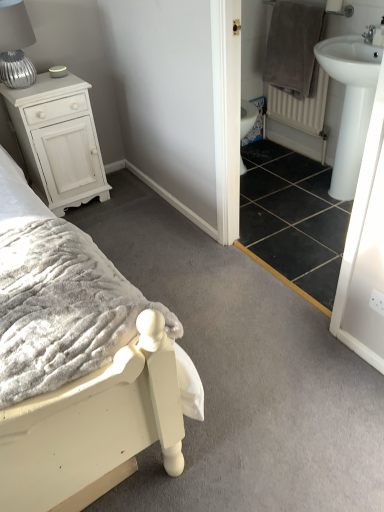
Describe the element at coordinates (293, 48) in the screenshot. I see `gray plush towel at upper right` at that location.

The height and width of the screenshot is (512, 384). What do you see at coordinates (79, 362) in the screenshot?
I see `white textured bed at center` at bounding box center [79, 362].

Describe the element at coordinates (58, 140) in the screenshot. This screenshot has width=384, height=512. I see `white painted wood chest of drawers at upper left` at that location.

Identify the location of white glossy bidet at center. (247, 117).

What do you see at coordinates (300, 106) in the screenshot? I see `white textured radiator at right` at bounding box center [300, 106].

You are a GUI agent. You are given a task and a screenshot of the screen. Output one action in this format:
    pyautogui.click(x=<x>, y=<y>)
    Task: Click on the white textured radiator at right
    Image resolution: width=384 pixels, height=512 pixels.
    Given the screenshot: What is the action you would take?
    pyautogui.click(x=300, y=106)

The height and width of the screenshot is (512, 384). Describe the element at coordinates (350, 104) in the screenshot. I see `white glossy sink at right` at that location.

What do you see at coordinates (365, 251) in the screenshot? The height and width of the screenshot is (512, 384). I see `white glossy sink at right` at bounding box center [365, 251].

I want to click on gray plush towel at upper right, so click(293, 48).

Considering the relative sizes of white glossy sink at right and gray plush towel at upper right in the image provided, is white glossy sink at right bigger than gray plush towel at upper right?

Correct, white glossy sink at right is larger in size than gray plush towel at upper right.

Is white glossy sink at right situated inside gray plush towel at upper right or outside?

white glossy sink at right exists outside the volume of gray plush towel at upper right.

Which object is positioned more to the left, white glossy sink at right or gray plush towel at upper right?

Positioned to the left is gray plush towel at upper right.

Who is taller, white glossy sink at right or gray plush towel at upper right?

With more height is white glossy sink at right.

Who is taller, white glossy bidet at center or white textured radiator at right?

Standing taller between the two is white textured radiator at right.

Which is closer, (242, 129) or (320, 126)?

Clearly, point (242, 129) is more distant from the camera than point (320, 126).

Is white textured radiator at right a part of white glossy bidet at center?

No.

Is white glossy bidet at center aimed at white textured radiator at right?

Yes, white glossy bidet at center is turned towards white textured radiator at right.

Is white textured radiator at right placed right next to white glossy sink at right?

No, white textured radiator at right is not with white glossy sink at right.

Does white textured radiator at right have a larger size compared to white glossy sink at right?

Incorrect, white textured radiator at right is not larger than white glossy sink at right.

From the image's perspective, does white textured radiator at right appear lower than white glossy sink at right?

Actually, white textured radiator at right appears above white glossy sink at right in the image.

Considering the points (320, 82) and (323, 42), which point is in front, point (320, 82) or point (323, 42)?

The point (323, 42) is closer to the camera.

Does gray plush towel at upper right turn towards white glossy bidet at center?

No.

From the image's perspective, would you say gray plush towel at upper right is shown under white glossy bidet at center?

No, from the image's perspective, gray plush towel at upper right is not beneath white glossy bidet at center.

Is gray plush towel at upper right positioned behind white glossy bidet at center?

No, gray plush towel at upper right is closer to the viewer.

Between gray plush towel at upper right and white glossy bidet at center, which one has smaller width?

With smaller width is white glossy bidet at center.

Is white glossy bidet at center not close to gray plush towel at upper right?

No, there isn't a large distance between white glossy bidet at center and gray plush towel at upper right.

Where is `bidet located on the left of gray plush towel at upper right`? Image resolution: width=384 pixels, height=512 pixels. bidet located on the left of gray plush towel at upper right is located at coordinates (247, 117).

Considering the positions of objects white glossy bidet at center and gray plush towel at upper right in the image provided, who is behind, white glossy bidet at center or gray plush towel at upper right?

white glossy bidet at center is behind.

Is white glossy bidet at center positioned with its back to gray plush towel at upper right?

That's not correct — white glossy bidet at center is not looking away from gray plush towel at upper right.

This screenshot has width=384, height=512. In order to click on sink on the right of the white textured bed at center in this screenshot , I will do `click(350, 104)`.

From a real-world perspective, relative to white textured bed at center, is white glossy sink at right vertically above or below?

Clearly, from a real-world perspective, white glossy sink at right is below white textured bed at center.

From the image's perspective, is white glossy sink at right below white textured bed at center?

No, from the image's perspective, white glossy sink at right is not beneath white textured bed at center.

In terms of height, does white glossy sink at right look taller or shorter compared to white textured bed at center?

Considering their sizes, white glossy sink at right has less height than white textured bed at center.

Does white glossy bidet at center turn towards white textured bed at center?

No, white glossy bidet at center is not facing towards white textured bed at center.

In terms of height, does white glossy bidet at center look taller or shorter compared to white textured bed at center?

Clearly, white glossy bidet at center is shorter compared to white textured bed at center.

From the image's perspective, between white glossy bidet at center and white textured bed at center, which one is located above?

white glossy bidet at center appears higher in the image.

Is white glossy bidet at center wider than white textured bed at center?

Incorrect, the width of white glossy bidet at center does not surpass that of white textured bed at center.

Identify the location of blanket lying behind the white glossy sink at right. Image resolution: width=384 pixels, height=512 pixels. (293, 48).

Where is `bidet beneath the white textured radiator at right (from a real-world perspective)`? bidet beneath the white textured radiator at right (from a real-world perspective) is located at coordinates (247, 117).

Considering their positions, is white glossy bidet at center positioned further to white textured bed at center than gray plush towel at upper right?

Among the two, white glossy bidet at center is located further to white textured bed at center.

Considering their positions, is white glossy bidet at center positioned further to gray plush towel at upper right than white textured radiator at right?

Among the two, white glossy bidet at center is located further to gray plush towel at upper right.

From the image, which object appears to be farther from silver ribbed table lamp at left, white textured bed at center or white glossy bidet at center?

Among the two, white glossy bidet at center is located further to silver ribbed table lamp at left.

Based on their spatial positions, is white glossy bidet at center or gray plush towel at upper right closer to silver ribbed table lamp at left?

gray plush towel at upper right.

Considering their positions, is white glossy sink at right positioned closer to white glossy bidet at center than white textured bed at center?

Among the two, white glossy sink at right is located nearer to white glossy bidet at center.

Consider the image. When comparing their distances from white painted wood chest of drawers at upper left, does gray plush towel at upper right or white glossy sink at right seem closer?

gray plush towel at upper right.

From the image, which object appears to be farther from white glossy sink at right, silver ribbed table lamp at left or white textured radiator at right?

The object further to white glossy sink at right is silver ribbed table lamp at left.

Which object lies nearer to the anchor point white textured bed at center, white glossy sink at right or silver ribbed table lamp at left?

white glossy sink at right is closer to white textured bed at center.

At what (x,y) coordinates should I click in order to perform the action: click on radiator between silver ribbed table lamp at left and white glossy sink at right in the horizontal direction. Please return your answer as a coordinate pair (x, y). This screenshot has width=384, height=512. Looking at the image, I should click on (300, 106).

Find the location of `chest of drawers between silver ribbed table lamp at left and gray plush towel at upper right from left to right`. chest of drawers between silver ribbed table lamp at left and gray plush towel at upper right from left to right is located at coordinates (58, 140).

This screenshot has height=512, width=384. What are the coordinates of `blanket between white glossy sink at right and white glossy bidet at center along the z-axis` in the screenshot? It's located at (293, 48).

Where is `blanket positioned between white glossy sink at right and white textured radiator at right from near to far`? blanket positioned between white glossy sink at right and white textured radiator at right from near to far is located at coordinates (293, 48).